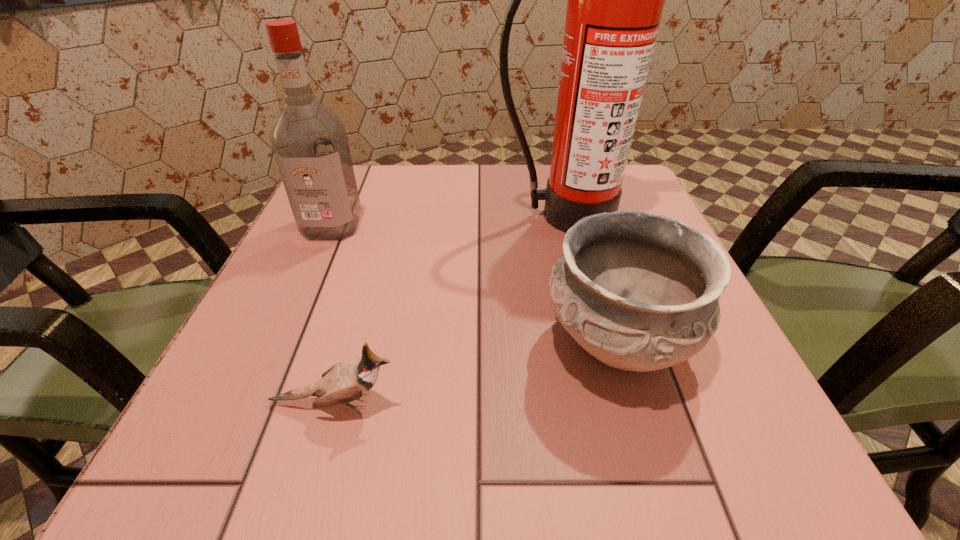
This screenshot has width=960, height=540. What are the coordinates of `object positioned at the near edge` in the screenshot? It's located at (344, 382).

This screenshot has height=540, width=960. What are the coordinates of `liquor at the left edge` in the screenshot? It's located at (309, 141).

This screenshot has width=960, height=540. I want to click on bird located in the left edge section of the desktop, so click(344, 382).

What are the coordinates of `fire extinguisher present at the right edge` in the screenshot? It's located at (615, 2).

You are a GUI agent. You are given a task and a screenshot of the screen. Output one action in this format:
    pyautogui.click(x=<x>, y=<y>)
    Task: Click on the pottery that is at the right edge
    
    Given the screenshot: What is the action you would take?
    pyautogui.click(x=640, y=292)

Find the location of a particular element. object located in the far left corner section of the desktop is located at coordinates [x=309, y=141].

This screenshot has height=540, width=960. Find the location of `object positioned at the near left corner`. object positioned at the near left corner is located at coordinates (344, 382).

You are a GUI agent. You are given a task and a screenshot of the screen. Output one action in this format:
    pyautogui.click(x=<x>, y=<y>)
    Task: Click on the object present at the far right corner
    The height and width of the screenshot is (540, 960).
    Given the screenshot: What is the action you would take?
    (x=615, y=2)

Where is `vacant space at the far edge`? vacant space at the far edge is located at coordinates (462, 193).

Identify the location of vacant space at the near edge of the desktop. The image size is (960, 540). click(x=424, y=450).